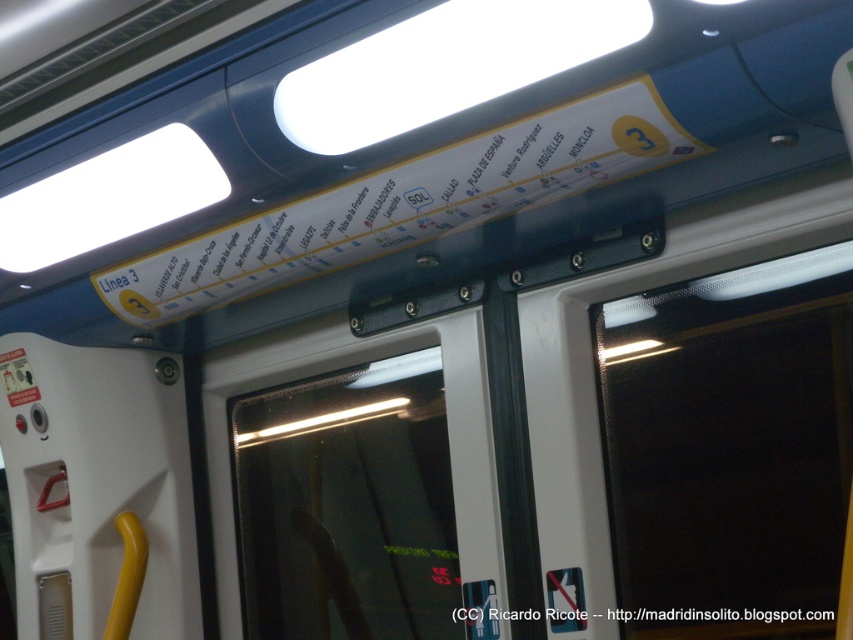
Is transparent glass door at center bigger than white paper sign at upper center?

Correct, transparent glass door at center is larger in size than white paper sign at upper center.

What do you see at coordinates (352, 476) in the screenshot? I see `transparent glass door at center` at bounding box center [352, 476].

Consider the image. Who is more distant from viewer, (300,380) or (576,620)?

Positioned behind is point (300,380).

Image resolution: width=853 pixels, height=640 pixels. I want to click on transparent glass door at center, so click(352, 476).